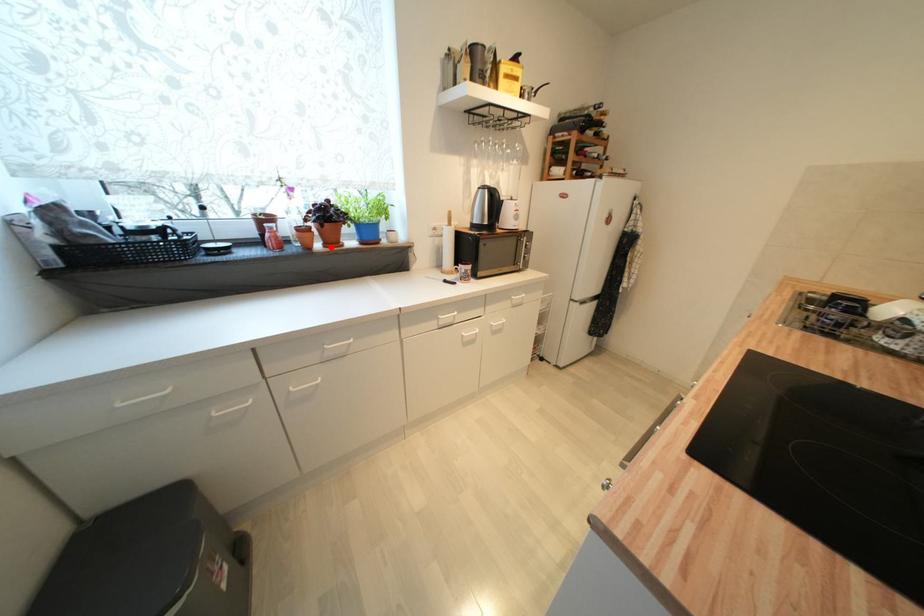
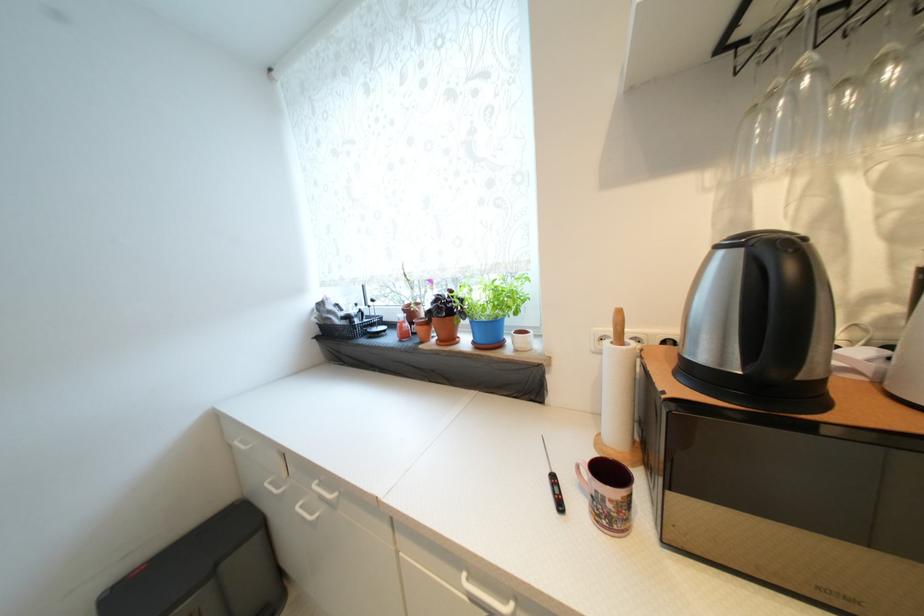
Find the pixel in the second image that matches the highlighted location in the first image.

(445, 342)